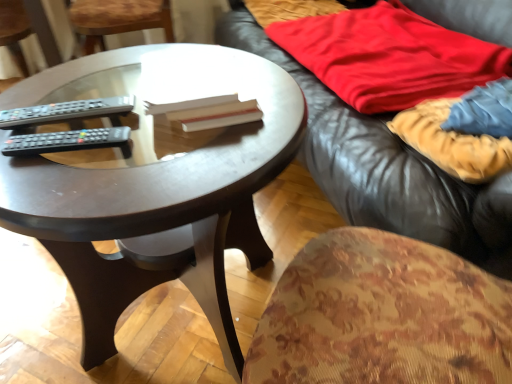
Question: From a real-world perspective, is dark wood coffee table at center physically above red cotton blanket at upper right, acting as the 2th blanket starting from the front?

Choices:
 (A) no
 (B) yes

Answer: (A)

Question: Is dark wood coffee table at center closer to the viewer compared to red cotton blanket at upper right, acting as the 2th blanket starting from the front?

Choices:
 (A) no
 (B) yes

Answer: (B)

Question: Is dark wood coffee table at center completely or partially outside of red cotton blanket at upper right, arranged as the first blanket when viewed from the back?

Choices:
 (A) yes
 (B) no

Answer: (A)

Question: Is dark wood coffee table at center facing away from red cotton blanket at upper right, arranged as the first blanket when viewed from the back?

Choices:
 (A) no
 (B) yes

Answer: (B)

Question: From the image's perspective, does dark wood coffee table at center appear higher than red cotton blanket at upper right, acting as the 2th blanket starting from the front?

Choices:
 (A) no
 (B) yes

Answer: (A)

Question: Is dark wood coffee table at center taller than red cotton blanket at upper right, arranged as the first blanket when viewed from the back?

Choices:
 (A) no
 (B) yes

Answer: (B)

Question: From the image's perspective, would you say wooden at left is positioned over velvet-like beige blanket at right, placed as the 2th blanket when sorted from back to front?

Choices:
 (A) yes
 (B) no

Answer: (A)

Question: Does wooden at left come in front of velvet-like beige blanket at right, positioned as the first blanket in front-to-back order?

Choices:
 (A) no
 (B) yes

Answer: (A)

Question: Does wooden at left have a lesser width compared to velvet-like beige blanket at right, positioned as the first blanket in front-to-back order?

Choices:
 (A) yes
 (B) no

Answer: (B)

Question: Is wooden at left far from velvet-like beige blanket at right, placed as the 2th blanket when sorted from back to front?

Choices:
 (A) no
 (B) yes

Answer: (B)

Question: Is wooden at left aimed at velvet-like beige blanket at right, positioned as the first blanket in front-to-back order?

Choices:
 (A) no
 (B) yes

Answer: (A)

Question: Are wooden at left and velvet-like beige blanket at right, placed as the 2th blanket when sorted from back to front, beside each other?

Choices:
 (A) no
 (B) yes

Answer: (A)

Question: Is velvet-like beige blanket at right, placed as the 2th blanket when sorted from back to front, positioned far away from dark wood coffee table at center?

Choices:
 (A) no
 (B) yes

Answer: (A)